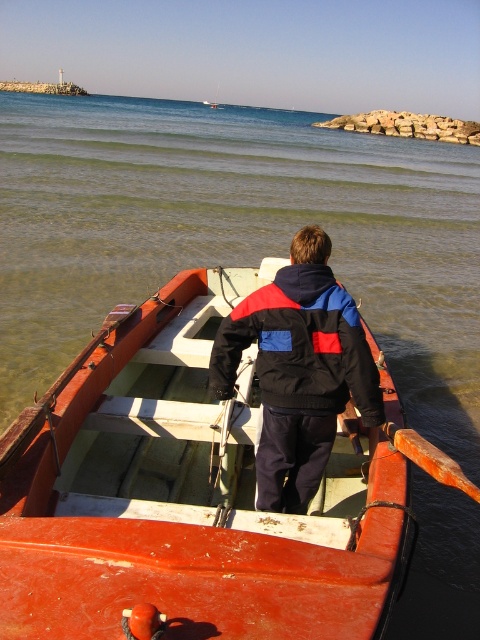
Who is shorter, smooth wood boat at center or black nylon jacket at center?

With less height is black nylon jacket at center.

Locate an element on the screen. This screenshot has width=480, height=640. smooth wood boat at center is located at coordinates (180, 493).